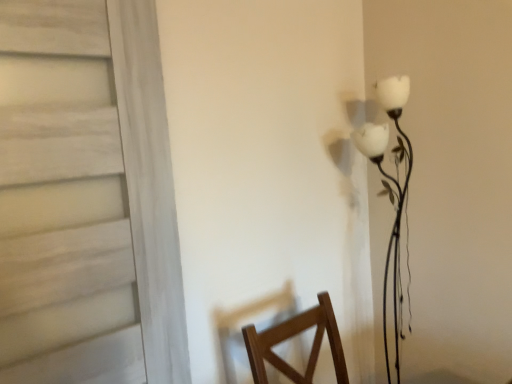
What do you see at coordinates (391, 197) in the screenshot?
I see `white matte floral lamp at right` at bounding box center [391, 197].

In order to click on white matte floral lamp at right in this screenshot , I will do `click(391, 197)`.

In order to face white wood door at left, should I rotate leftwards or rightwards?

Turn left by 21.246 degrees to look at white wood door at left.

Image resolution: width=512 pixels, height=384 pixels. Describe the element at coordinates (86, 198) in the screenshot. I see `white wood door at left` at that location.

I want to click on white wood door at left, so click(86, 198).

Measure the distance between white wood door at left and camera.

white wood door at left is 97.89 centimeters away from camera.

In order to click on white matte floral lamp at right in this screenshot , I will do `click(391, 197)`.

Is white matte floral lamp at right to the left or to the right of white wood door at left in the image?

white matte floral lamp at right is to the right of white wood door at left.

Who is more distant, white matte floral lamp at right or white wood door at left?

white matte floral lamp at right.

Considering the points (402, 294) and (66, 154), which point is behind, point (402, 294) or point (66, 154)?

The point (402, 294) is farther.

From the image's perspective, between white matte floral lamp at right and white wood door at left, who is located below?

white matte floral lamp at right, from the image's perspective.

From a real-world perspective, is white matte floral lamp at right over white wood door at left?

No, from a real-world perspective, white matte floral lamp at right is not on top of white wood door at left.

Between white matte floral lamp at right and white wood door at left, which one has larger width?

white matte floral lamp at right is wider.

From their relative heights in the image, would you say white matte floral lamp at right is taller or shorter than white wood door at left?

In the image, white matte floral lamp at right appears to be taller than white wood door at left.

Between white matte floral lamp at right and white wood door at left, which one has smaller size?

white matte floral lamp at right is smaller.

Would you say white matte floral lamp at right is inside or outside white wood door at left?

white matte floral lamp at right is outside white wood door at left.

Would you say white matte floral lamp at right is a long distance from white wood door at left?

That's not correct — white matte floral lamp at right is a little close to white wood door at left.

Is white matte floral lamp at right oriented away from white wood door at left?

No.

Locate an element on the screen. Image resolution: width=512 pixels, height=384 pixels. table lamp that appears behind the white wood door at left is located at coordinates tap(391, 197).

Based on the photo, which is more to the right, white wood door at left or white matte floral lamp at right?

Positioned to the right is white matte floral lamp at right.

In the scene shown: Is the position of white wood door at left less distant than that of white matte floral lamp at right?

Yes, white wood door at left is closer to the viewer.

Is point (90, 276) farther from viewer compared to point (379, 143)?

No, it is not.

From the image's perspective, who appears lower, white wood door at left or white matte floral lamp at right?

white matte floral lamp at right appears lower in the image.

From a real-world perspective, is white wood door at left physically above white matte floral lamp at right?

Indeed, from a real-world perspective, white wood door at left stands above white matte floral lamp at right.

Which of these two, white wood door at left or white matte floral lamp at right, is wider?

With larger width is white matte floral lamp at right.

From their relative heights in the image, would you say white wood door at left is taller or shorter than white matte floral lamp at right?

In the image, white wood door at left appears to be shorter than white matte floral lamp at right.

Considering the sizes of objects white wood door at left and white matte floral lamp at right in the image provided, who is smaller, white wood door at left or white matte floral lamp at right?

white matte floral lamp at right.

Is white wood door at left located outside white matte floral lamp at right?

That's correct, white wood door at left is outside of white matte floral lamp at right.

Are white wood door at left and white matte floral lamp at right located far from each other?

No, there isn't a large distance between white wood door at left and white matte floral lamp at right.

Is white wood door at left aimed at white matte floral lamp at right?

No, white wood door at left is not facing towards white matte floral lamp at right.

Find the location of a particular element. The height and width of the screenshot is (384, 512). table lamp beneath the white wood door at left (from a real-world perspective) is located at coordinates (391, 197).

Locate an element on the screen. The image size is (512, 384). door that appears above the white matte floral lamp at right (from a real-world perspective) is located at coordinates (86, 198).

The height and width of the screenshot is (384, 512). I want to click on table lamp below the white wood door at left (from the image's perspective), so click(x=391, y=197).